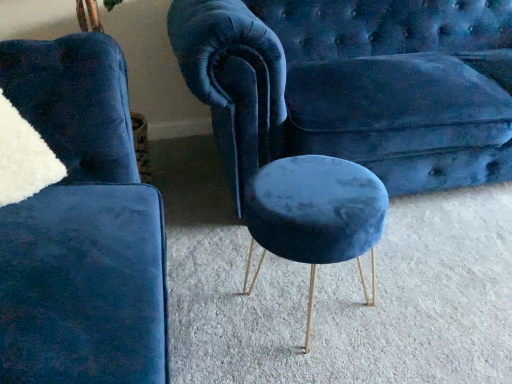
The width and height of the screenshot is (512, 384). I want to click on vacant space that is in between velvet blue stool at center and velvet blue couch at center, so click(412, 257).